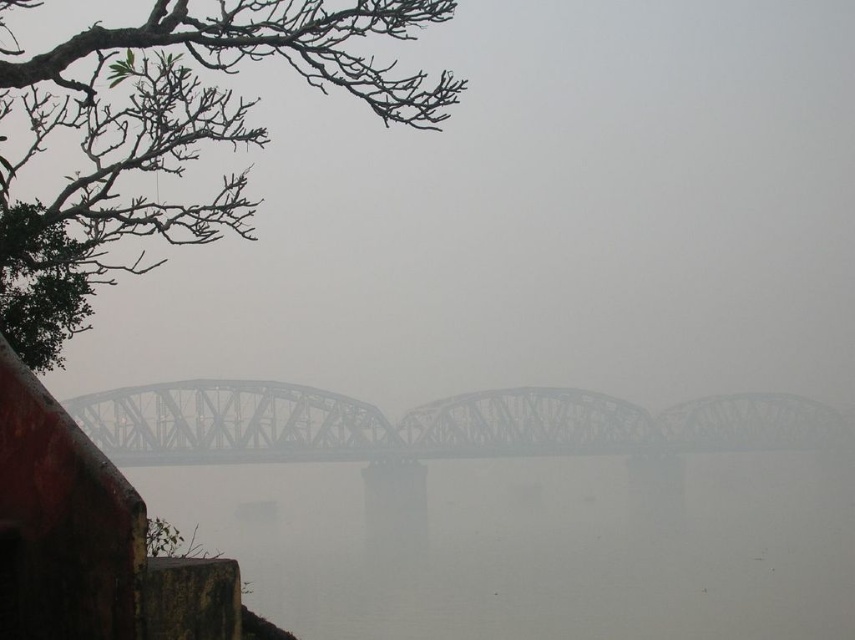
You are a photographer planning to capture the foggy gray bridge at center and the steel bridge at center in a single shot. Since you want both bridges to be clearly visible, which bridge should you focus on first to ensure proper depth of field?

You should focus on the steel bridge at center first because the foggy gray bridge at center is positioned on the left side of it, meaning it is farther away. Proper depth of field requires focusing on the closer object to ensure both are in focus.

You are standing at the point with coordinates point [532,218] in the image. Based on the scene description, what object does this point most likely represent?

The point [532,218] corresponds to the foggy gray bridge at center.

Based on the photo, you are a photographer planning to capture the steel bridge at center and the gray foggy river at center in a single shot. Based on their sizes in the scene, which one would you need to frame more carefully to ensure it doesn

The gray foggy river at center is smaller than the steel bridge at center, so you should frame the gray foggy river at center more carefully to ensure it is properly captured in the shot.